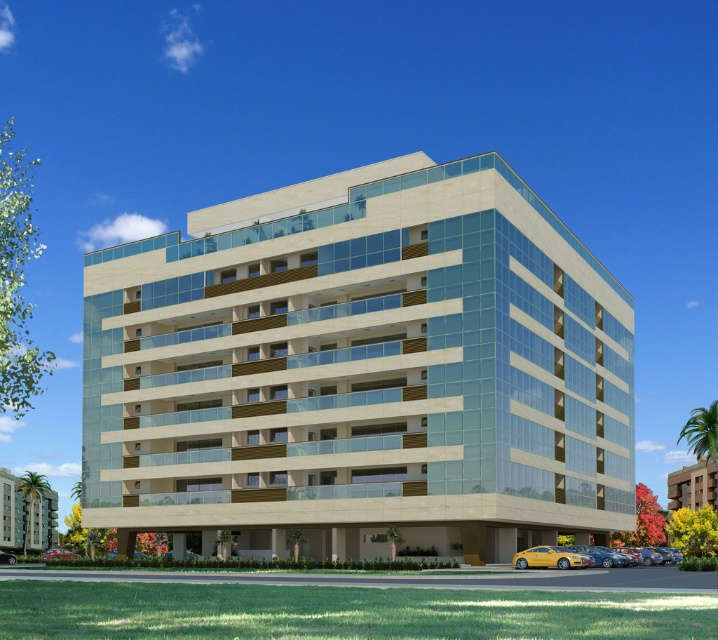
Can you confirm if beige stone building at center is positioned below metallic silver car at lower left?

Incorrect, beige stone building at center is not positioned below metallic silver car at lower left.

From the picture: Does beige stone building at center appear on the left side of metallic silver car at lower left?

In fact, beige stone building at center is to the right of metallic silver car at lower left.

Is point (169, 500) more distant than point (9, 554)?

No, (169, 500) is in front of (9, 554).

I want to click on beige stone building at center, so click(363, 371).

Which is above, yellow matte car at lower right or metallic red car at lower left?

yellow matte car at lower right

Who is shorter, yellow matte car at lower right or metallic red car at lower left?

Standing shorter between the two is yellow matte car at lower right.

Describe the element at coordinates (573, 557) in the screenshot. The height and width of the screenshot is (640, 718). I see `yellow matte car at lower right` at that location.

Identify the location of yellow matte car at lower right. (573, 557).

Which of these two, beige stone hotel at lower right or metallic red car at lower left, stands shorter?

metallic red car at lower left is shorter.

The image size is (718, 640). I want to click on beige stone hotel at lower right, so click(691, 484).

Is point (668, 474) closer to camera compared to point (60, 557)?

No, (668, 474) is further to viewer.

Where is `beige stone hotel at lower right`? Image resolution: width=718 pixels, height=640 pixels. beige stone hotel at lower right is located at coordinates (691, 484).